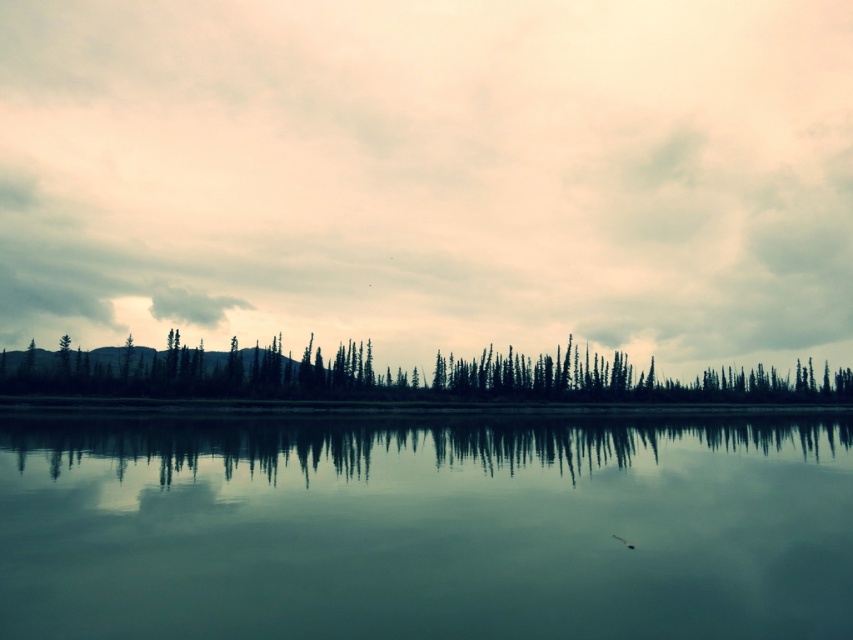
Is cloudy sky at upper center below smooth glass water at center?

No.

Which of these two, cloudy sky at upper center or smooth glass water at center, stands shorter?

With less height is smooth glass water at center.

The image size is (853, 640). What are the coordinates of `cloudy sky at upper center` in the screenshot? It's located at (430, 176).

Where is `cloudy sky at upper center`? The image size is (853, 640). cloudy sky at upper center is located at coordinates (430, 176).

Which is below, smooth glass water at center or dark green textured trees at center?

Positioned lower is smooth glass water at center.

Can you confirm if smooth glass water at center is positioned above dark green textured trees at center?

Incorrect, smooth glass water at center is not positioned above dark green textured trees at center.

Identify the location of smooth glass water at center. This screenshot has height=640, width=853. (426, 529).

At what (x,y) coordinates should I click in order to perform the action: click on smooth glass water at center. Please return your answer as a coordinate pair (x, y). The height and width of the screenshot is (640, 853). Looking at the image, I should click on [x=426, y=529].

Between cloudy sky at upper center and dark green textured trees at center, which one is positioned lower?

dark green textured trees at center is lower down.

Is cloudy sky at upper center thinner than dark green textured trees at center?

Incorrect, cloudy sky at upper center's width is not less than dark green textured trees at center's.

The height and width of the screenshot is (640, 853). In order to click on cloudy sky at upper center in this screenshot , I will do `click(430, 176)`.